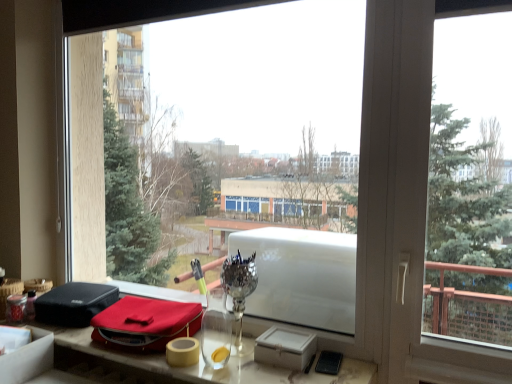
Question: Based on their sizes in the image, would you say velvet red pouch at lower left is bigger or smaller than matte red bag at lower center?

Choices:
 (A) big
 (B) small

Answer: (B)

Question: Considering their positions, is velvet red pouch at lower left located in front of or behind matte red bag at lower center?

Choices:
 (A) front
 (B) behind

Answer: (B)

Question: From a real-world perspective, relative to matte red bag at lower center, is velvet red pouch at lower left vertically above or below?

Choices:
 (A) below
 (B) above

Answer: (B)

Question: Which is correct: matte red bag at lower center is inside velvet red pouch at lower left, or outside of it?

Choices:
 (A) inside
 (B) outside

Answer: (B)

Question: Is matte red bag at lower center taller or shorter than velvet red pouch at lower left?

Choices:
 (A) tall
 (B) short

Answer: (B)

Question: Based on their positions, is matte red bag at lower center located to the left or right of velvet red pouch at lower left?

Choices:
 (A) right
 (B) left

Answer: (A)

Question: In terms of width, does matte red bag at lower center look wider or thinner when compared to velvet red pouch at lower left?

Choices:
 (A) wide
 (B) thin

Answer: (A)